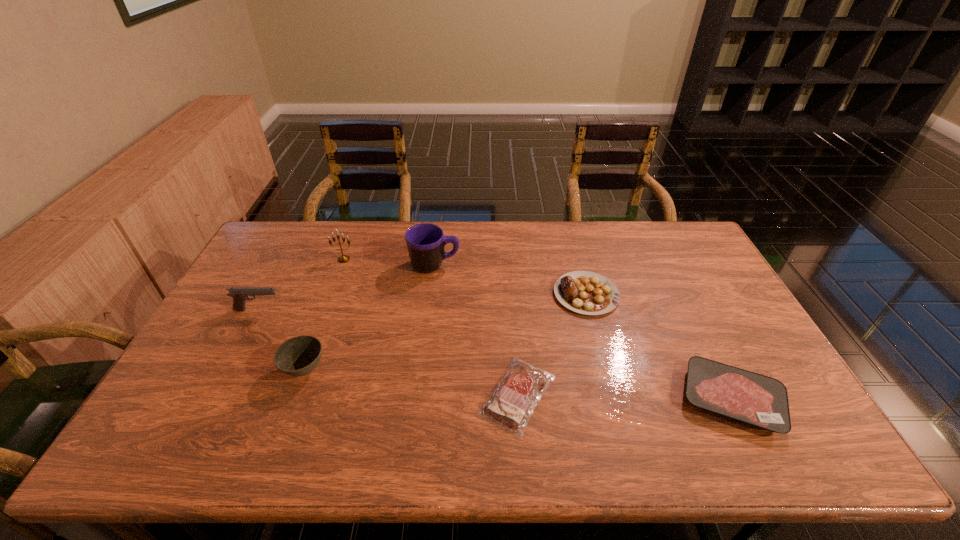
Locate an element on the screen. empty location between the shortest object and the candelabrum is located at coordinates (430, 327).

What are the coordinates of `free spot between the fourth tallest object and the shortest steak` in the screenshot? It's located at (411, 383).

Find the location of a particular element. The width and height of the screenshot is (960, 540). vacant area between the shortest steak and the bowl is located at coordinates (411, 383).

Image resolution: width=960 pixels, height=540 pixels. Find the location of `free spot between the pistol and the farthest steak`. free spot between the pistol and the farthest steak is located at coordinates (422, 302).

Where is `free space between the mug and the tallest steak`? The image size is (960, 540). free space between the mug and the tallest steak is located at coordinates (511, 280).

I want to click on vacant area that lies between the mug and the second object from right to left, so click(x=511, y=280).

I want to click on vacant area that lies between the second shortest steak and the leftmost object, so click(x=495, y=355).

At what (x,y) coordinates should I click in order to perform the action: click on vacant region between the fifth object from left to right and the bowl. Please return your answer as a coordinate pair (x, y). This screenshot has width=960, height=540. Looking at the image, I should click on (411, 383).

Where is `free space between the pistol and the rightmost object`? This screenshot has width=960, height=540. free space between the pistol and the rightmost object is located at coordinates (495, 355).

Point out which object is positioned as the second nearest to the sixth tallest object. Please provide its 2D coordinates. Your answer should be formatted as a tuple, i.e. [(x, y)], where the tuple contains the x and y coordinates of a point satisfying the conditions above.

[(510, 406)]